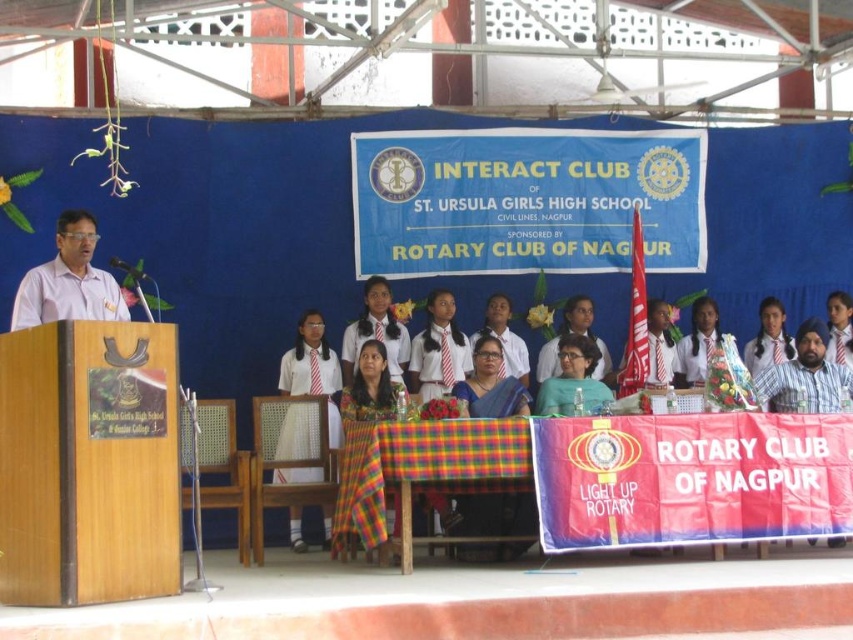
You are standing at the location of the viewer. There is a point at coordinates point (316, 388). Can you reach that point without moving your feet?

The point at coordinates point (316, 388) is 155.91 feet away from you, so you cannot reach it without moving your feet.

You are an event photographer at the St. Ursula Girls High School event. You need to capture a closeup shot of the speaker wearing the matte blue shirt at center and his matte black glasses at center. Can you fit both objects in the frame if your camera has a maximum width capacity of 20 cm?

The matte blue shirt at center is wider than the matte black glasses at center. Since the camera has a maximum width capacity of 20 cm, and the shirt is wider than the glasses, it depends on the combined width of both objects. However, the description only states the shirt is wider than the glasses but does not provide exact measurements. Without knowing the exact widths, it is uncertain if both will fit within the 20 cm limit.